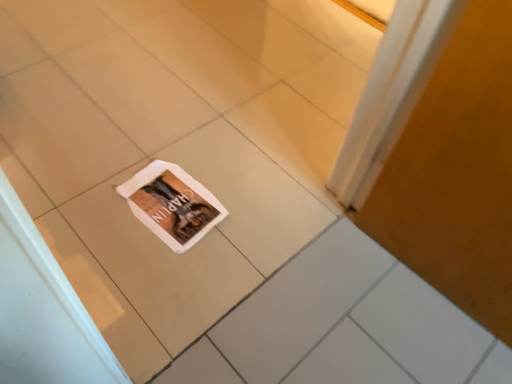
Identify the location of free area behind white paper postcard at center. (190, 142).